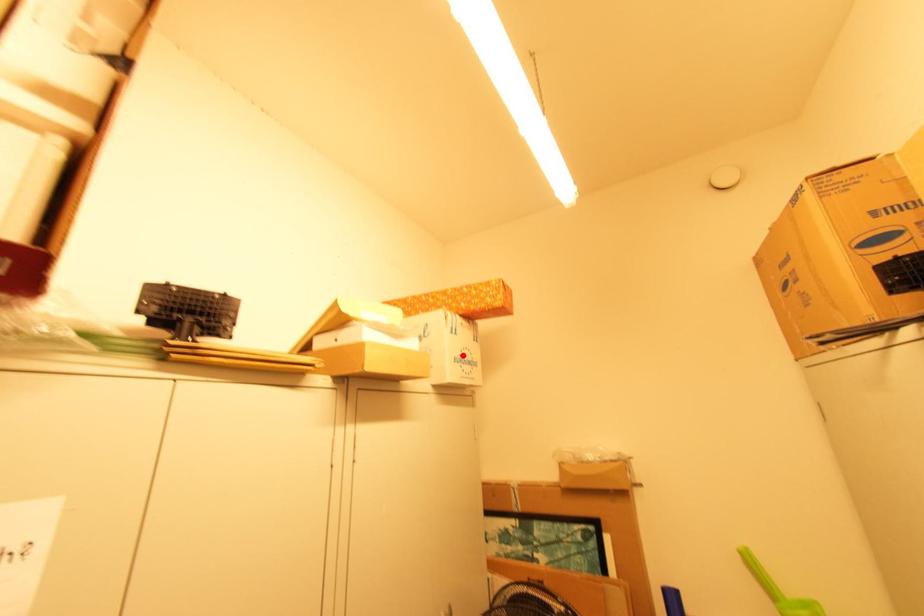
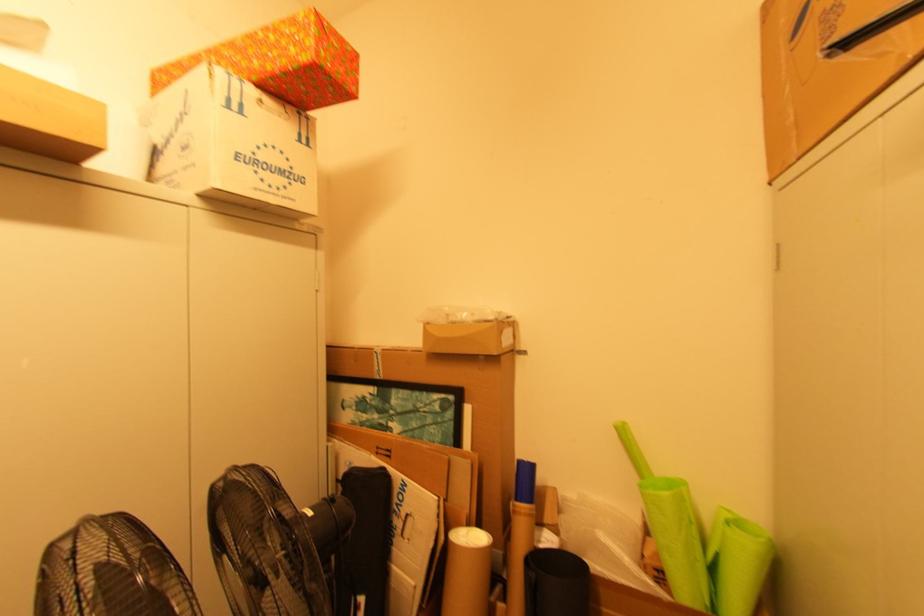
Locate, in the second image, the point that corresponds to the highlighted location in the first image.

(257, 154)